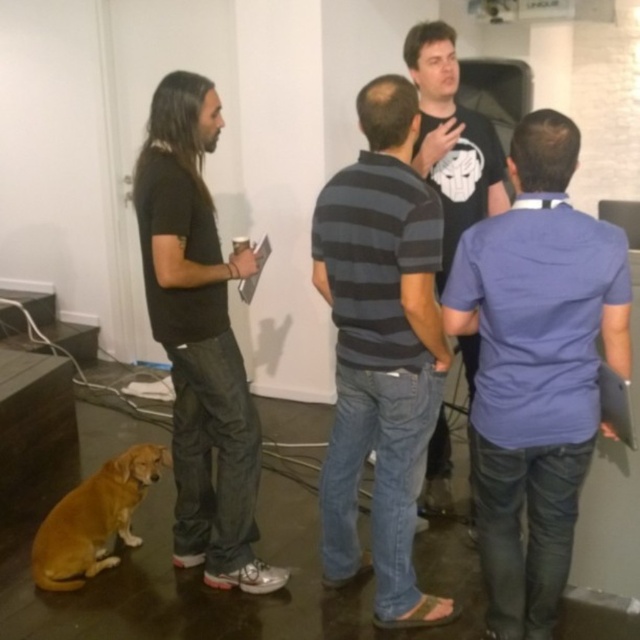
You are standing at the door on the left side of the frame and want to take a photo of two points in the room. The first point is at coordinates point (x=428, y=49) and the second point is at point (x=74, y=506). Which point will appear larger in your photo?

Point (x=428, y=49) is closer to the camera than point (x=74, y=506), so it will appear larger in the photo.